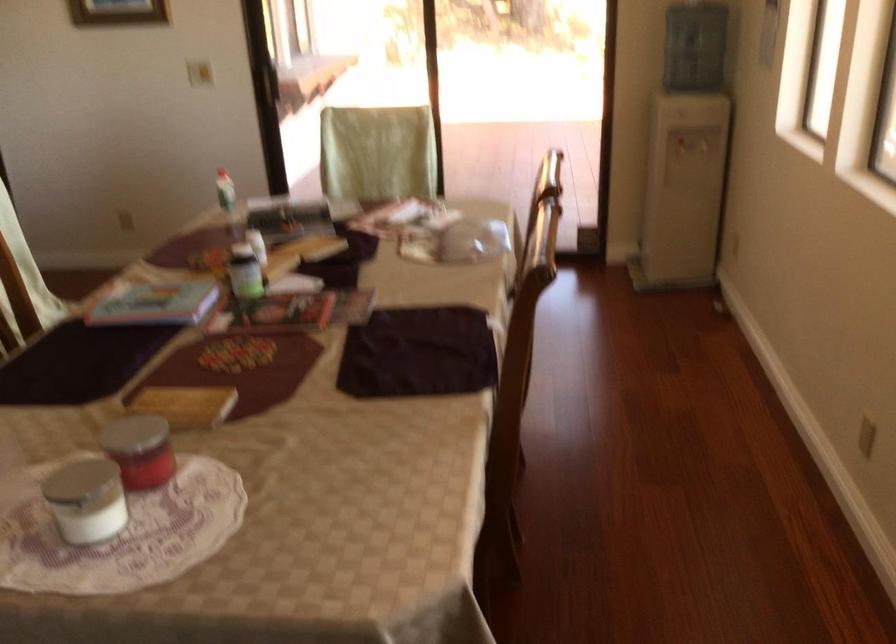
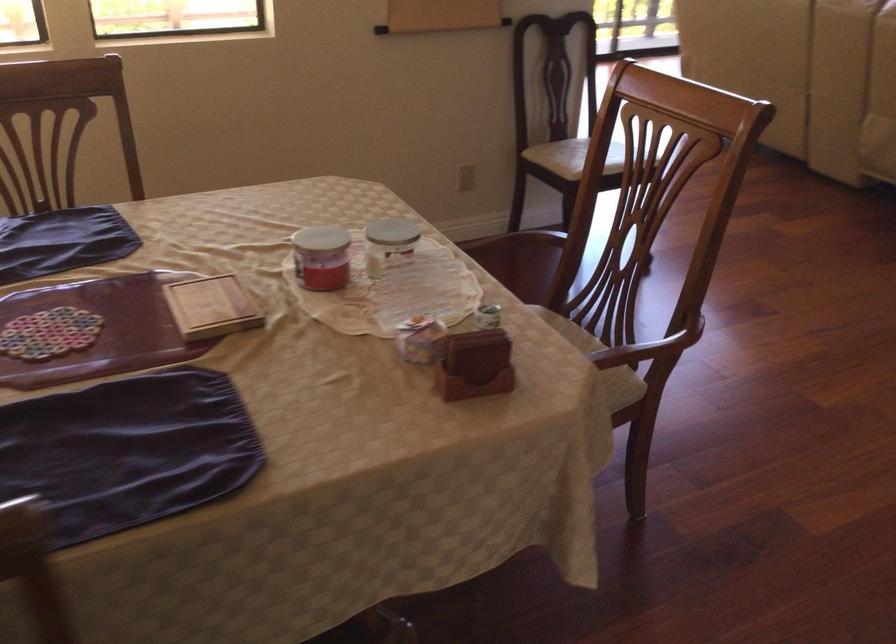
Where in the second image is the point corresponding to (140,447) from the first image?

(321, 257)